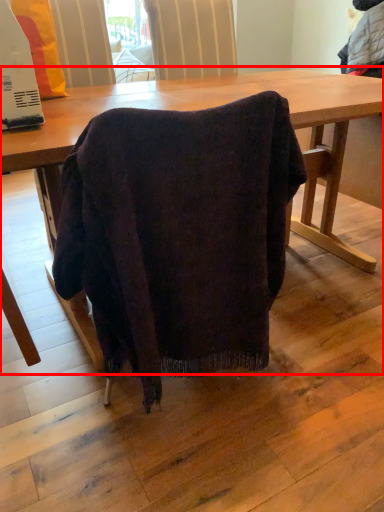
Question: From the image's perspective, what is the correct spatial relationship of table (annotated by the red box) in relation to appliance?

Choices:
 (A) above
 (B) below

Answer: (B)